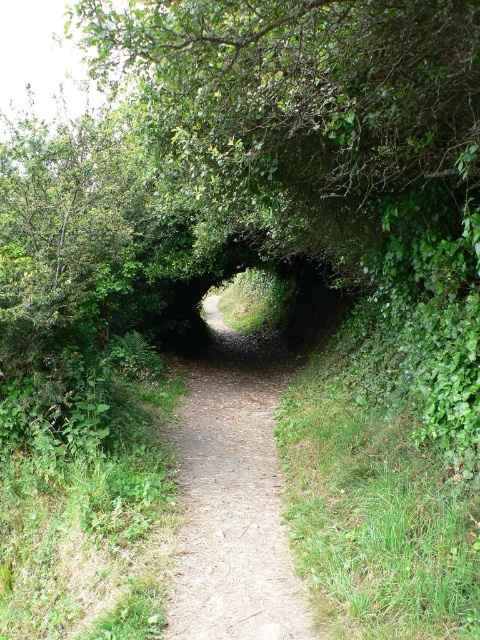
In the scene shown: Who is lower down, green leafy tree at center or dirt path at center?

dirt path at center is lower down.

Who is more distant from viewer, (330, 257) or (239, 449)?

The point (330, 257) is more distant.

At what (x,y) coordinates should I click in order to perform the action: click on green leafy tree at center. Please return your answer as a coordinate pair (x, y). Looking at the image, I should click on (307, 113).